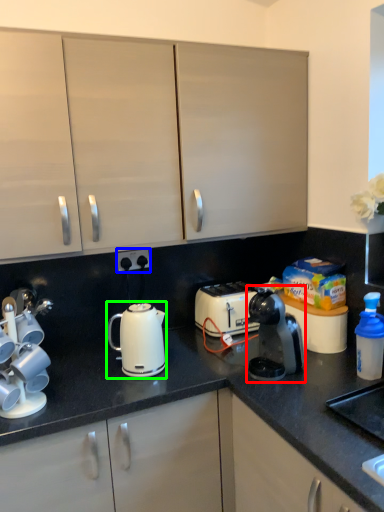
Question: Based on their relative distances, which object is farther from home appliance (highlighted by a red box)? Choose from electric outlet (highlighted by a blue box) and kettle (highlighted by a green box).

Choices:
 (A) electric outlet
 (B) kettle

Answer: (A)